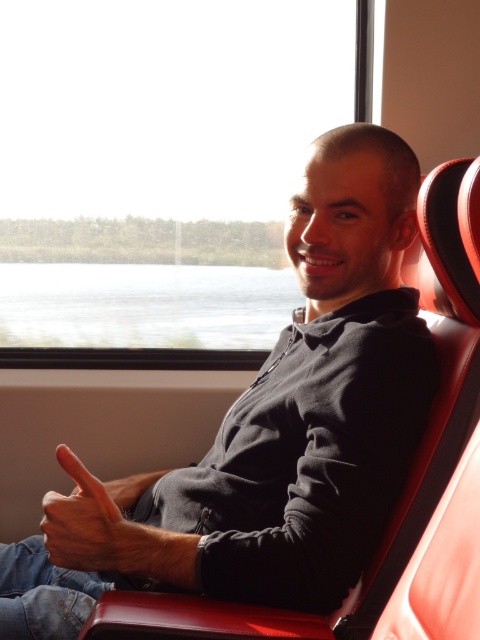
Measure the distance from transparent glass window at upper center to matte black hand at center.

transparent glass window at upper center and matte black hand at center are 4.27 feet apart.

Is transparent glass window at upper center positioned behind matte black hand at center?

Yes, it is.

The height and width of the screenshot is (640, 480). Find the location of `transparent glass window at upper center`. transparent glass window at upper center is located at coordinates (160, 172).

Find the location of `transparent glass window at upper center`. transparent glass window at upper center is located at coordinates (160, 172).

Is the position of transparent glass window at upper center more distant than that of matte black hoodie at center?

That is True.

Is transparent glass window at upper center below matte black hoodie at center?

No, transparent glass window at upper center is not below matte black hoodie at center.

Where is `transparent glass window at upper center`? This screenshot has height=640, width=480. transparent glass window at upper center is located at coordinates (160, 172).

Where is `transparent glass window at upper center`? transparent glass window at upper center is located at coordinates (160, 172).

Is matte black hoodie at center smaller than matte black hand at center?

No, matte black hoodie at center is not smaller than matte black hand at center.

The width and height of the screenshot is (480, 640). In order to click on matte black hoodie at center in this screenshot , I will do `click(268, 429)`.

Between point (146, 563) and point (45, 529), which one is positioned in front?

Positioned in front is point (146, 563).

The height and width of the screenshot is (640, 480). What are the coordinates of `matte black hoodie at center` in the screenshot? It's located at (268, 429).